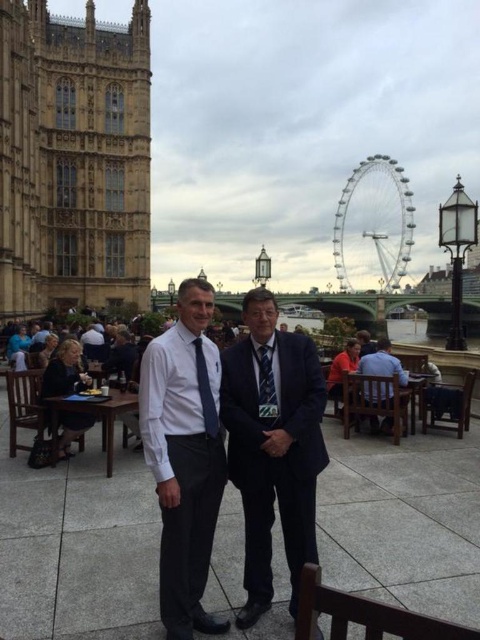
You are a photographer trying to capture a clear shot of both the white shirt at center and the patterned silk tie at center. Since you want to ensure both are in focus, which object should you focus on first to account for their sizes?

The white shirt at center is much taller than the patterned silk tie at center, so you should focus on the white shirt at center first to ensure both are in focus.

You are a photographer trying to capture both the patterned silk tie at center and the blue silk tie at center in a single frame. Given their spatial relationship, which tie should you focus on to ensure both are clearly visible without cropping?

The patterned silk tie at center occupies less space than the blue silk tie at center, so focusing on the blue silk tie at center would allow both ties to be captured clearly since it takes up more space and can serve as a focal point while the smaller patterned silk tie at center remains in view.